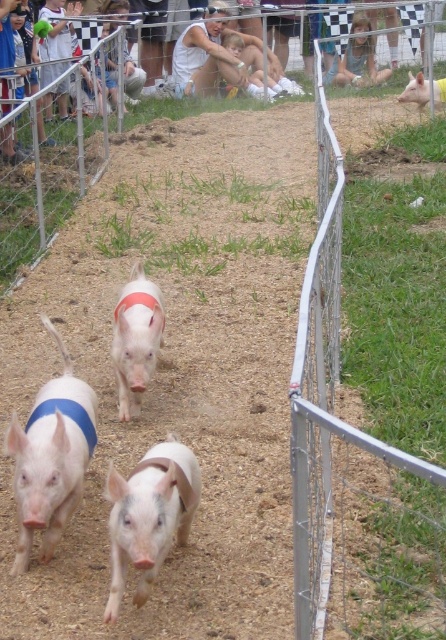
Can you confirm if pink fabric pig at center is taller than pink smooth pig at upper right?

A: Yes.

Does pink fabric pig at center have a lesser height compared to pink smooth pig at upper right?

In fact, pink fabric pig at center may be taller than pink smooth pig at upper right.

Is point (95, 404) behind point (429, 88)?

No, (95, 404) is in front of (429, 88).

You are a GUI agent. You are given a task and a screenshot of the screen. Output one action in this format:
    pyautogui.click(x=<x>, y=<y>)
    Task: Click on the pink fabric pig at center
    
    Given the screenshot: What is the action you would take?
    pyautogui.click(x=50, y=458)

Is point (141, 577) positioned after point (123, 307)?

That is False.

Does pink smooth pig at center appear on the left side of white matte pig at center?

No, pink smooth pig at center is not to the left of white matte pig at center.

What do you see at coordinates (148, 515) in the screenshot? This screenshot has height=640, width=446. I see `pink smooth pig at center` at bounding box center [148, 515].

The image size is (446, 640). Identify the location of pink smooth pig at center. (148, 515).

Can you confirm if pink fabric pig at center is thinner than pink smooth pig at center?

Yes.

Does pink fabric pig at center appear on the left side of pink smooth pig at center?

Correct, you'll find pink fabric pig at center to the left of pink smooth pig at center.

Does point (15, 493) come closer to viewer compared to point (115, 506)?

That is False.

You are a GUI agent. You are given a task and a screenshot of the screen. Output one action in this format:
    pyautogui.click(x=<x>, y=<y>)
    Task: Click on the pink fabric pig at center
    The height and width of the screenshot is (640, 446).
    Given the screenshot: What is the action you would take?
    pyautogui.click(x=50, y=458)